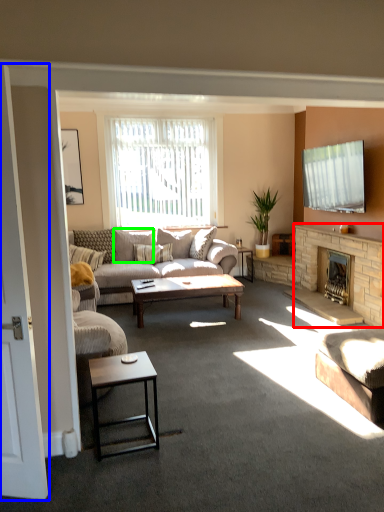
Question: Based on their relative distances, which object is farther from fireplace (highlighted by a red box)? Choose from screen door (highlighted by a blue box) and pillow (highlighted by a green box).

Choices:
 (A) screen door
 (B) pillow

Answer: (A)